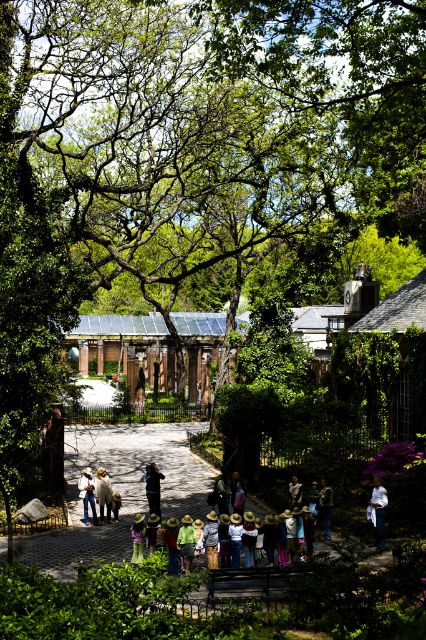
Consider the image. You are a photographer standing on the cobblestone pathway below the large tree. You want to take a photo of both the dark blue jeans at center and the green straw hat at center. Which object should you focus on first to ensure both are in frame?

The dark blue jeans at center is taller than the green straw hat at center, so you should focus on the dark blue jeans at center first to ensure both are in frame.

You are standing at the point marked as point [328,529] in the image, which is 43.04 meters away from you. You want to take a photo of the tree with the group of people in the foreground. Is the tree visible in your current position?

The tree is visible because you are positioned at point [328,529], which is 43.04 meters away from the tree. Since the tree is the central focus and dominates the upper portion of the frame, it should be visible in your current position.